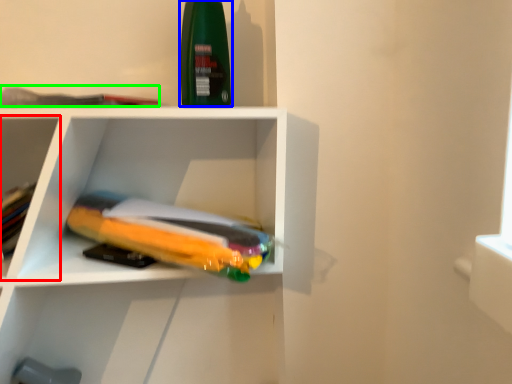
Question: Based on their relative distances, which object is farther from shelf (highlighted by a red box)? Choose from cleaning product (highlighted by a blue box) and book (highlighted by a green box).

Choices:
 (A) cleaning product
 (B) book

Answer: (A)